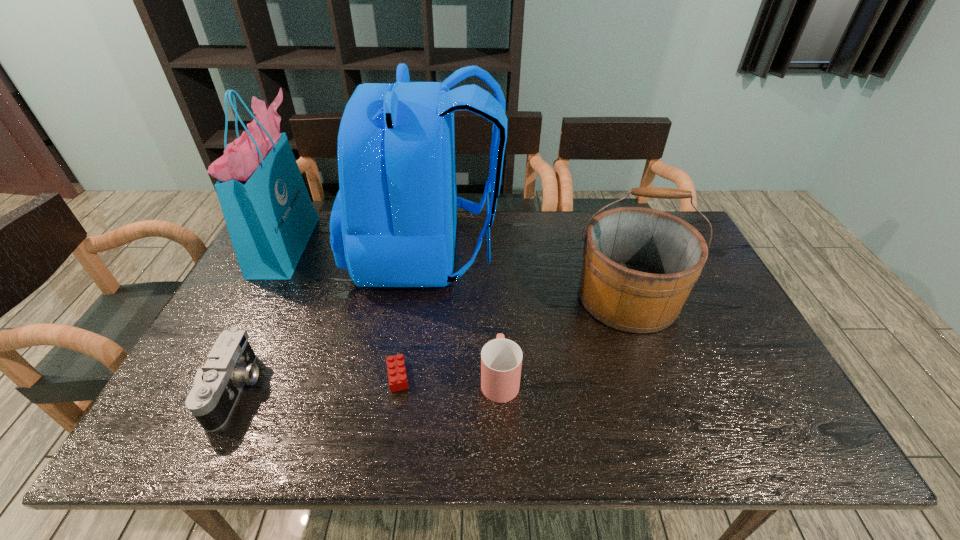
Locate an element on the screen. The width and height of the screenshot is (960, 540). free space between the shortest object and the shopping bag is located at coordinates (342, 310).

The height and width of the screenshot is (540, 960). Find the location of `free space between the shortest object and the cup`. free space between the shortest object and the cup is located at coordinates [x=448, y=377].

The image size is (960, 540). In order to click on free space between the camera and the shortest object in this screenshot , I will do `click(317, 383)`.

Image resolution: width=960 pixels, height=540 pixels. In order to click on free space between the cup and the shopping bag in this screenshot , I will do `click(393, 311)`.

You are a GUI agent. You are given a task and a screenshot of the screen. Output one action in this format:
    pyautogui.click(x=<x>, y=<y>)
    Task: Click on the vacant point located between the Lego and the camera
    
    Given the screenshot: What is the action you would take?
    pyautogui.click(x=317, y=383)

Find the location of `free spot between the bucket and the cup`. free spot between the bucket and the cup is located at coordinates (564, 338).

You are a GUI agent. You are given a task and a screenshot of the screen. Output one action in this format:
    pyautogui.click(x=<x>, y=<y>)
    Task: Click on the vacant area between the bucket and the shopping bag
    
    Given the screenshot: What is the action you would take?
    pyautogui.click(x=457, y=271)

Find the location of a particular element. the second closest object to the camera is located at coordinates (270, 217).

This screenshot has height=540, width=960. In order to click on the fifth closest object relative to the backpack in this screenshot , I will do `click(230, 364)`.

Identify the location of free point that satisfies the following two spatial constraints: 1. on the side of the cup with the handle; 2. on the back of the backpack. (494, 252).